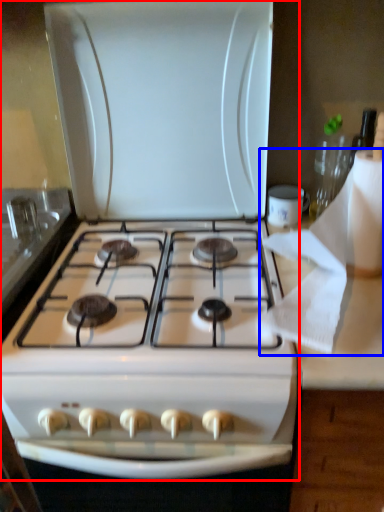
Question: Which of the following is the closest to the observer, gas stove (highlighted by a red box) or toilet paper (highlighted by a blue box)?

Choices:
 (A) gas stove
 (B) toilet paper

Answer: (B)